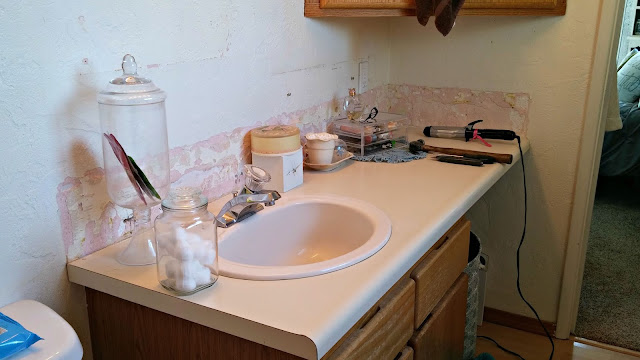
Where is `faucet handle`? faucet handle is located at coordinates (253, 180).